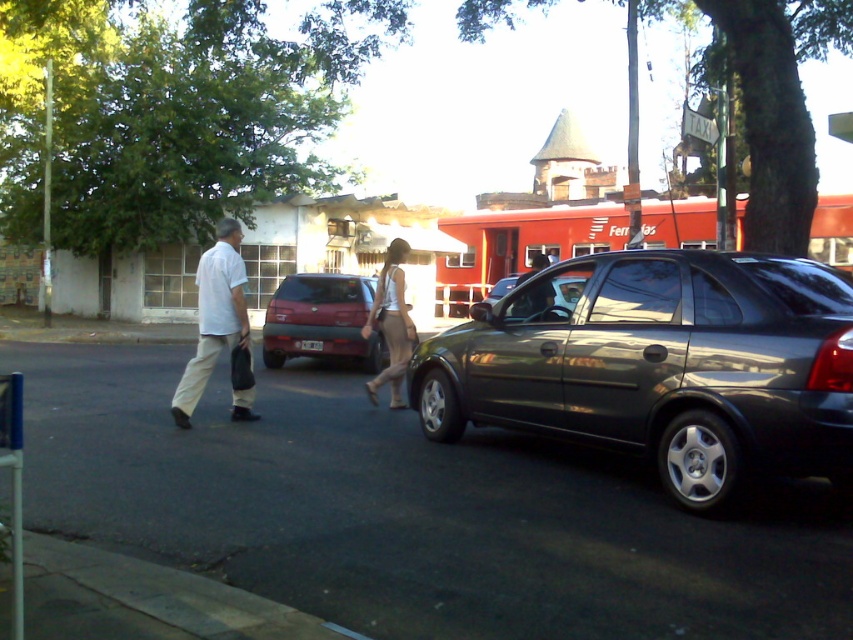
You are a delivery person needing to unload packages from the matte red hatchback at center and the matte black car at center. Which vehicle should you access first if you want to reach the one that is higher up?

The matte black car at center is higher up than the matte red hatchback at center, so you should access the matte black car at center first.

You are standing at the point labeled point [320,321]. Based on the scene description, what object are you currently standing on?

The point [320,321] is on the matte red hatchback at center, so you are standing on the matte red hatchback at center.